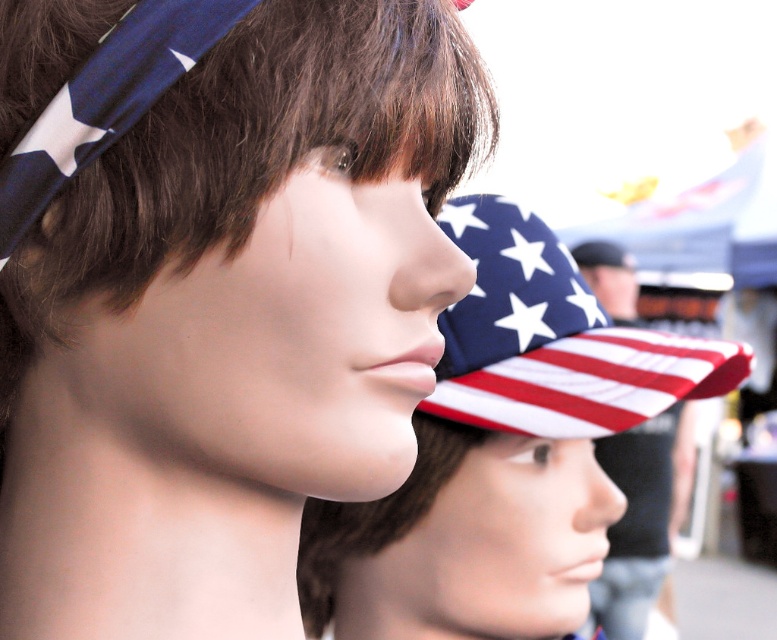
Question: Which of these objects is positioned farthest from the matte plastic mannequin head at center?

Choices:
 (A) american flag hat at center
 (B) american flag fabric baseball cap at center

Answer: (A)

Question: Is matte plastic mannequin head at center to the right of american flag hat at center from the viewer's perspective?

Choices:
 (A) yes
 (B) no

Answer: (B)

Question: Can you confirm if matte plastic mannequin head at center is thinner than american flag fabric baseball cap at center?

Choices:
 (A) no
 (B) yes

Answer: (B)

Question: In this image, where is matte plastic mannequin head at center located relative to american flag hat at center?

Choices:
 (A) left
 (B) right

Answer: (A)

Question: Which point is closer to the camera taking this photo?

Choices:
 (A) (598, 284)
 (B) (500, 268)
 (C) (89, 620)

Answer: (C)

Question: Which point appears closest to the camera in this image?

Choices:
 (A) (629, 452)
 (B) (500, 257)
 (C) (382, 260)

Answer: (C)